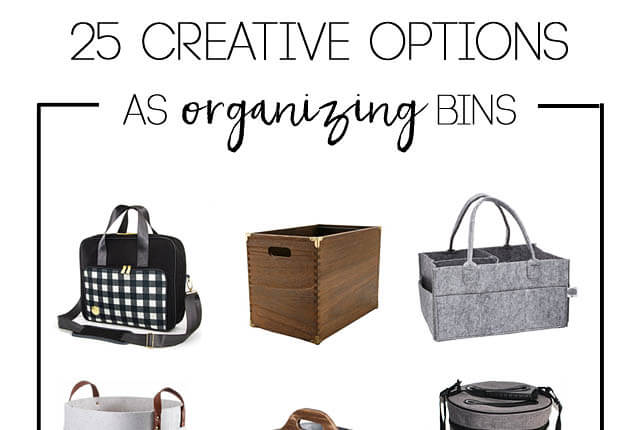
This screenshot has height=430, width=640. Find the location of `gold corner on wooden box`. gold corner on wooden box is located at coordinates (246, 237), (316, 238), (380, 226).